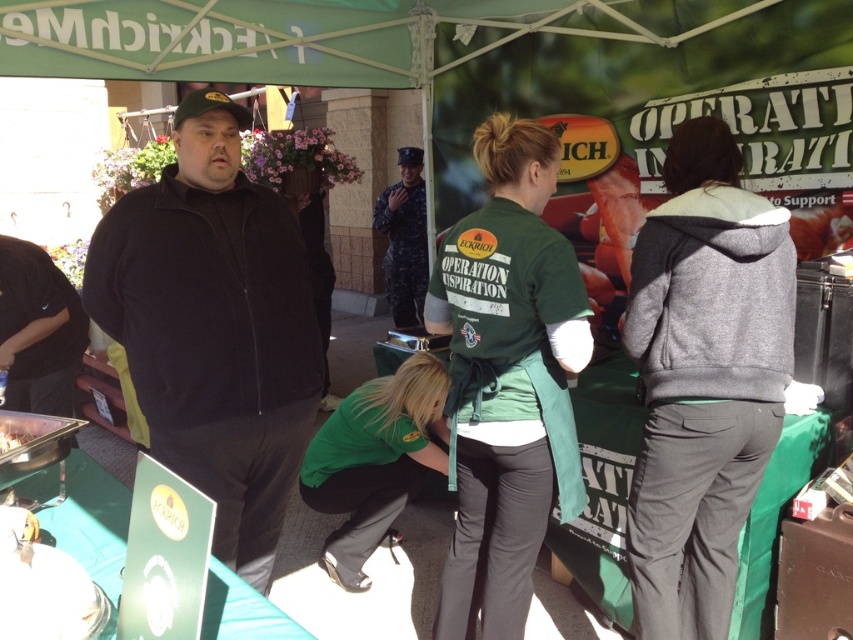
Question: Does black fleece jacket at center appear on the left side of gray fleece hoodie at right?

Choices:
 (A) yes
 (B) no

Answer: (A)

Question: Does gray fleece hoodie at right appear on the left side of green fabric shirt at center?

Choices:
 (A) no
 (B) yes

Answer: (A)

Question: Which object appears farthest from the camera in this image?

Choices:
 (A) camouflage fabric uniform at center
 (B) gray fleece hoodie at right
 (C) green fabric shirt at center
 (D) black fleece jacket at center

Answer: (A)

Question: Estimate the real-world distances between objects in this image. Which object is closer to the black fleece jacket at center?

Choices:
 (A) gray fleece hoodie at right
 (B) camouflage fabric uniform at center

Answer: (A)

Question: Is black fleece jacket at center further to the viewer compared to gray fleece hoodie at right?

Choices:
 (A) no
 (B) yes

Answer: (B)

Question: Among these objects, which one is farthest from the camera?

Choices:
 (A) black fleece jacket at center
 (B) green fabric shirt at center
 (C) camouflage fabric uniform at center
 (D) gray fleece hoodie at right

Answer: (C)